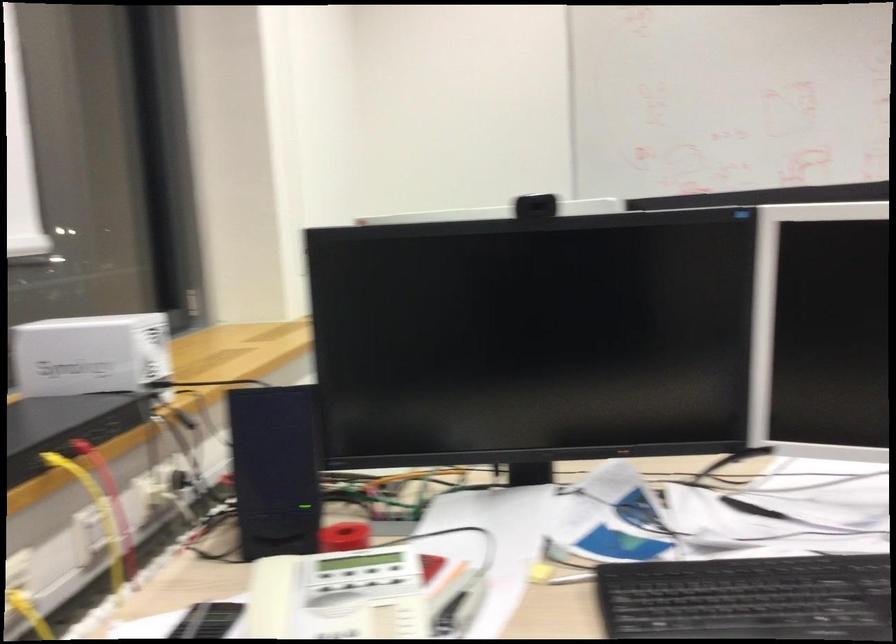
Find the location of `telephone handset`. telephone handset is located at coordinates (373, 590).